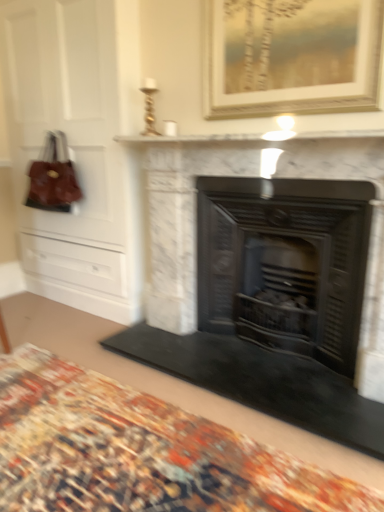
Question: Can we say gold-framed painting at upper center lies outside leather handbag at left?

Choices:
 (A) no
 (B) yes

Answer: (B)

Question: Is the position of gold-framed painting at upper center less distant than that of leather handbag at left?

Choices:
 (A) no
 (B) yes

Answer: (B)

Question: Is gold-framed painting at upper center to the left of leather handbag at left from the viewer's perspective?

Choices:
 (A) no
 (B) yes

Answer: (A)

Question: Can you confirm if gold-framed painting at upper center is bigger than leather handbag at left?

Choices:
 (A) yes
 (B) no

Answer: (B)

Question: Is gold-framed painting at upper center aimed at leather handbag at left?

Choices:
 (A) no
 (B) yes

Answer: (A)

Question: Is point (158, 137) positioned closer to the camera than point (38, 179)?

Choices:
 (A) closer
 (B) farther

Answer: (A)

Question: From a real-world perspective, is white marble fireplace at upper center positioned above or below leather handbag at left?

Choices:
 (A) below
 (B) above

Answer: (B)

Question: In the image, is white marble fireplace at upper center positioned in front of or behind leather handbag at left?

Choices:
 (A) front
 (B) behind

Answer: (A)

Question: Do you think white marble fireplace at upper center is within leather handbag at left, or outside of it?

Choices:
 (A) inside
 (B) outside

Answer: (B)

Question: From a real-world perspective, relative to carpeted rug at lower center, is white marble fireplace at center, the first fireplace in the left-to-right sequence, vertically above or below?

Choices:
 (A) below
 (B) above

Answer: (B)

Question: From their relative heights in the image, would you say white marble fireplace at center, the second fireplace when ordered from right to left, is taller or shorter than carpeted rug at lower center?

Choices:
 (A) tall
 (B) short

Answer: (A)

Question: Considering the positions of white marble fireplace at center, the first fireplace in the left-to-right sequence, and carpeted rug at lower center in the image, is white marble fireplace at center, the first fireplace in the left-to-right sequence, bigger or smaller than carpeted rug at lower center?

Choices:
 (A) small
 (B) big

Answer: (B)

Question: Which is correct: white marble fireplace at center, the second fireplace when ordered from right to left, is inside carpeted rug at lower center, or outside of it?

Choices:
 (A) inside
 (B) outside

Answer: (B)

Question: Is white marble fireplace at center, the second fireplace when ordered from right to left, in front of or behind gold-framed painting at upper center in the image?

Choices:
 (A) front
 (B) behind

Answer: (A)

Question: Is white marble fireplace at center, the second fireplace when ordered from right to left, situated inside gold-framed painting at upper center or outside?

Choices:
 (A) outside
 (B) inside

Answer: (A)